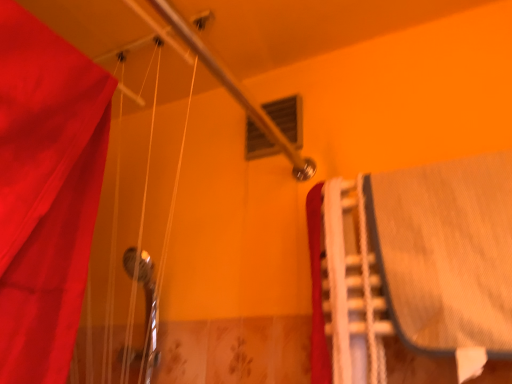
Question: From a real-world perspective, is matte plastic window at upper center over denim bed at right?

Choices:
 (A) yes
 (B) no

Answer: (A)

Question: Considering the relative sizes of matte plastic window at upper center and denim bed at right in the image provided, is matte plastic window at upper center smaller than denim bed at right?

Choices:
 (A) yes
 (B) no

Answer: (A)

Question: Is the position of matte plastic window at upper center more distant than that of denim bed at right?

Choices:
 (A) no
 (B) yes

Answer: (B)

Question: Is matte plastic window at upper center aimed at denim bed at right?

Choices:
 (A) yes
 (B) no

Answer: (B)

Question: Is the position of matte plastic window at upper center less distant than that of denim bed at right?

Choices:
 (A) yes
 (B) no

Answer: (B)

Question: Is matte plastic window at upper center next to denim bed at right?

Choices:
 (A) no
 (B) yes

Answer: (A)

Question: Is matte plastic window at upper center at the right side of white plastic stairs at right?

Choices:
 (A) no
 (B) yes

Answer: (A)

Question: Considering the relative sizes of matte plastic window at upper center and white plastic stairs at right in the image provided, is matte plastic window at upper center wider than white plastic stairs at right?

Choices:
 (A) no
 (B) yes

Answer: (A)

Question: Is white plastic stairs at right at the back of matte plastic window at upper center?

Choices:
 (A) yes
 (B) no

Answer: (B)

Question: Can you confirm if matte plastic window at upper center is thinner than white plastic stairs at right?

Choices:
 (A) yes
 (B) no

Answer: (A)

Question: Is white plastic stairs at right inside matte plastic window at upper center?

Choices:
 (A) yes
 (B) no

Answer: (B)

Question: Can you confirm if matte plastic window at upper center is positioned to the left of white plastic stairs at right?

Choices:
 (A) no
 (B) yes

Answer: (B)

Question: Is white plastic stairs at right outside of denim bed at right?

Choices:
 (A) no
 (B) yes

Answer: (A)